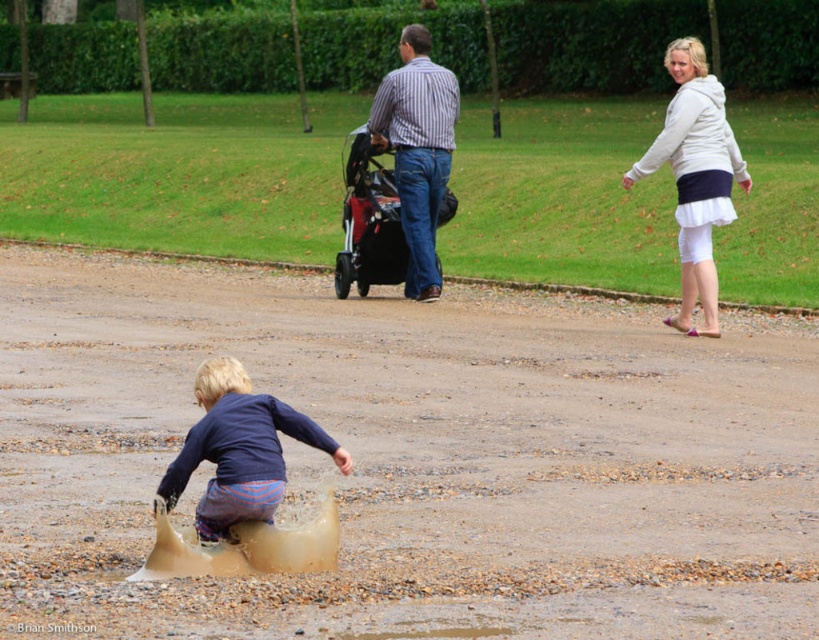
Can you confirm if blue cotton shirt at lower left is positioned to the left of striped cotton shirt at center?

Correct, you'll find blue cotton shirt at lower left to the left of striped cotton shirt at center.

Which of these two, blue cotton shirt at lower left or striped cotton shirt at center, stands shorter?

blue cotton shirt at lower left is shorter.

Describe the element at coordinates (238, 451) in the screenshot. The height and width of the screenshot is (640, 819). I see `blue cotton shirt at lower left` at that location.

You are a GUI agent. You are given a task and a screenshot of the screen. Output one action in this format:
    pyautogui.click(x=<x>, y=<y>)
    Task: Click on the blue cotton shirt at lower left
    
    Given the screenshot: What is the action you would take?
    pyautogui.click(x=238, y=451)

Can you confirm if brown gravel dirt track at lower center is bigger than red plastic baby carriage at center?

Indeed, brown gravel dirt track at lower center has a larger size compared to red plastic baby carriage at center.

Find the location of a particular element. This screenshot has width=819, height=640. brown gravel dirt track at lower center is located at coordinates (412, 458).

Does smooth concrete path at center come behind white matte skirt at upper right?

Yes, smooth concrete path at center is further from the viewer.

Is smooth concrete path at center closer to camera compared to white matte skirt at upper right?

No, smooth concrete path at center is further to the viewer.

Between point (451, 230) and point (741, 168), which one is positioned in front?

Positioned in front is point (741, 168).

Locate an element on the screen. The width and height of the screenshot is (819, 640). smooth concrete path at center is located at coordinates (179, 172).